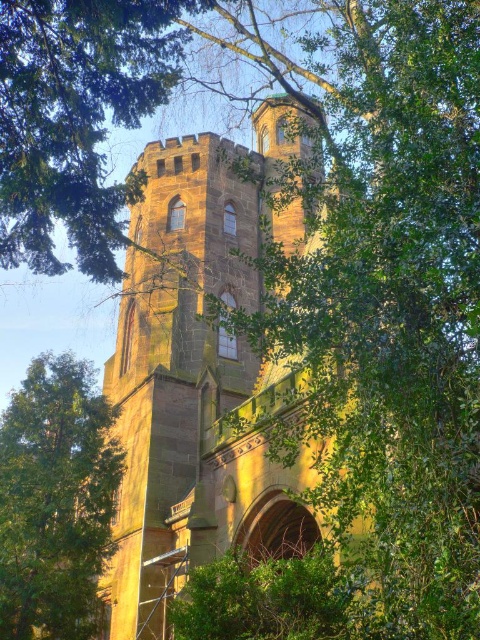
Question: Considering the relative positions of brown stone church at center and green leafy tree at center in the image provided, where is brown stone church at center located with respect to green leafy tree at center?

Choices:
 (A) left
 (B) right

Answer: (B)

Question: Considering the relative positions of brown stone church at center and green leafy tree at center in the image provided, where is brown stone church at center located with respect to green leafy tree at center?

Choices:
 (A) below
 (B) above

Answer: (B)

Question: Does brown stone church at center appear under green leafy tree at center?

Choices:
 (A) yes
 (B) no

Answer: (B)

Question: Which object appears farthest from the camera in this image?

Choices:
 (A) green leafy tree at center
 (B) brown stone church at center

Answer: (A)